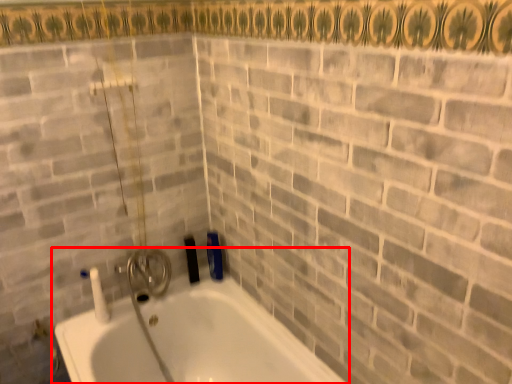
Question: Observing the image, what is the correct spatial positioning of bathtub (annotated by the red box) in reference to brick?

Choices:
 (A) right
 (B) left

Answer: (B)